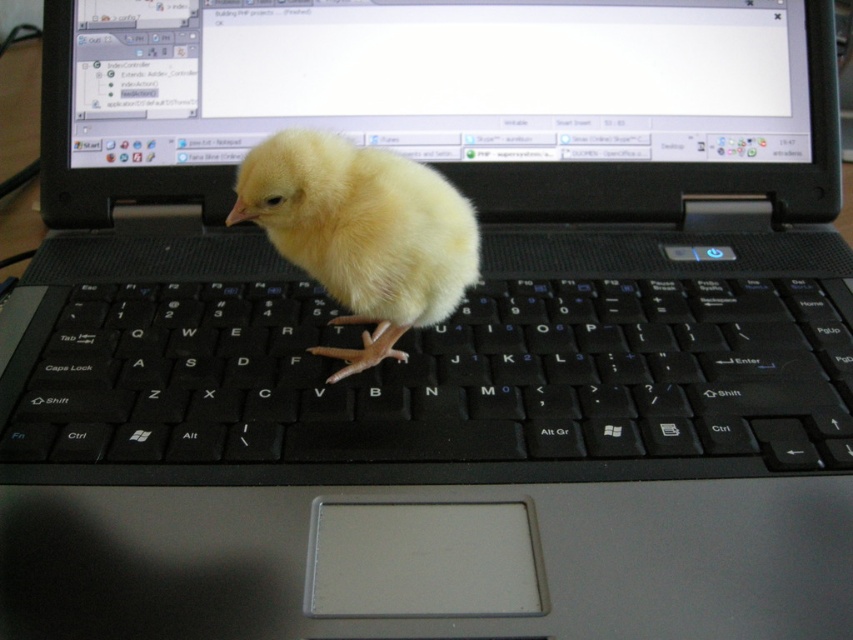
Between matte plastic screen at upper center and yellow fluffy chick at center, which one appears on the right side from the viewer's perspective?

matte plastic screen at upper center

Between matte plastic screen at upper center and yellow fluffy chick at center, which one has more height?

yellow fluffy chick at center is taller.

In order to click on matte plastic screen at upper center in this screenshot , I will do `click(440, 80)`.

This screenshot has height=640, width=853. I want to click on matte plastic screen at upper center, so click(440, 80).

Who is more forward, (219, 316) or (387, 316)?

Positioned in front is point (387, 316).

Does point (808, 401) come behind point (376, 208)?

Yes, point (808, 401) is farther from viewer.

At what (x,y) coordinates should I click in order to perform the action: click on black matte keyboard at center. Please return your answer as a coordinate pair (x, y). The width and height of the screenshot is (853, 640). Looking at the image, I should click on (433, 378).

I want to click on black matte keyboard at center, so click(433, 378).

Does black matte keyboard at center have a smaller size compared to matte plastic screen at upper center?

Actually, black matte keyboard at center might be larger than matte plastic screen at upper center.

Does point (723, 412) come behind point (686, 81)?

No.

Image resolution: width=853 pixels, height=640 pixels. What are the coordinates of `black matte keyboard at center` in the screenshot? It's located at (433, 378).